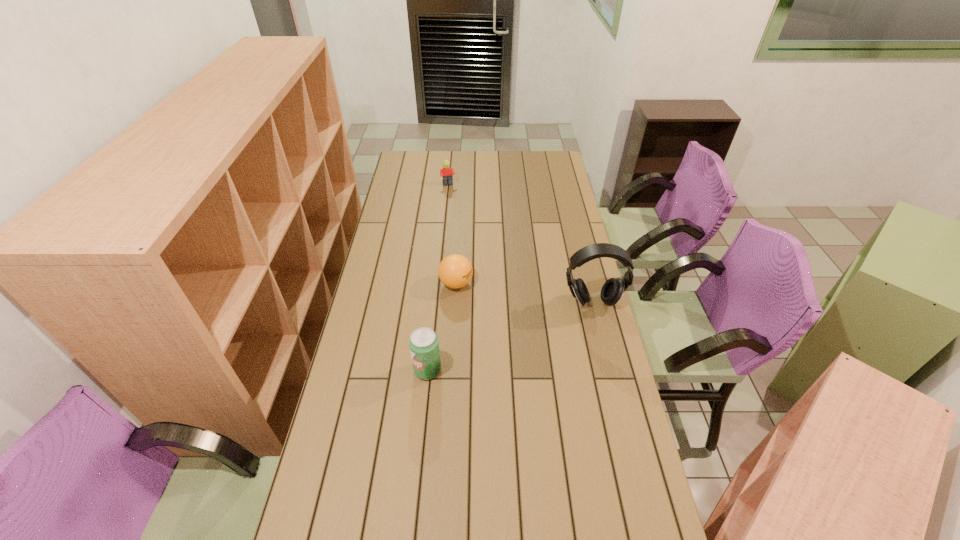
Find the location of `vacant spot on the desktop that is between the soda and the earphone and is positioned on the face of the farthest object`. vacant spot on the desktop that is between the soda and the earphone and is positioned on the face of the farthest object is located at coordinates (495, 342).

Where is `free space on the desktop that is between the second tallest object and the rightmost object and is positioned on the side with brand of the ping-pong ball`? The width and height of the screenshot is (960, 540). free space on the desktop that is between the second tallest object and the rightmost object and is positioned on the side with brand of the ping-pong ball is located at coordinates (512, 335).